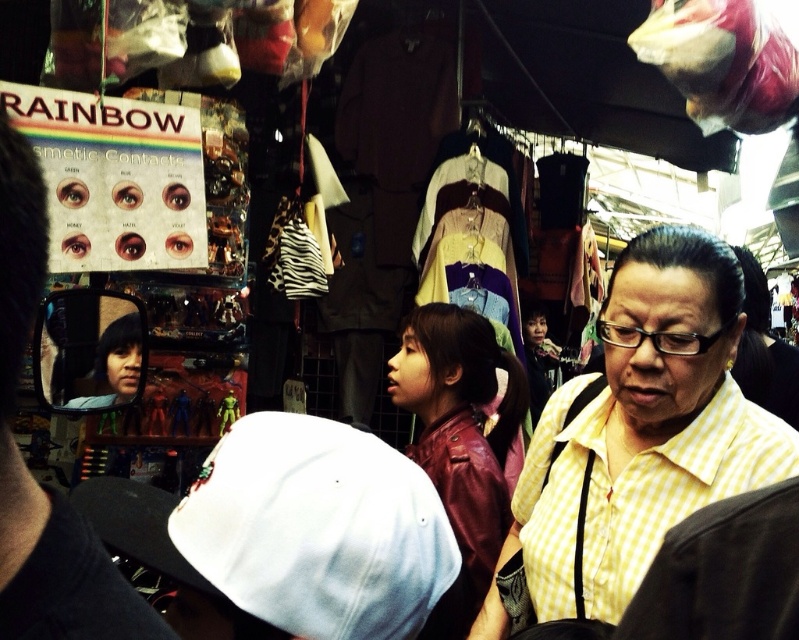
Question: Is yellow checkered shirt at center positioned behind leather jacket at center?

Choices:
 (A) no
 (B) yes

Answer: (B)

Question: Which object is positioned closest to the yellow checkered shirt at center?

Choices:
 (A) matte black cap at lower left
 (B) leather jacket at center

Answer: (B)

Question: Is yellow checkered shirt at center positioned behind matte black cap at lower left?

Choices:
 (A) no
 (B) yes

Answer: (B)

Question: Which object is farther from the camera taking this photo?

Choices:
 (A) matte black cap at lower left
 (B) leather jacket at center

Answer: (B)

Question: Is matte black cap at lower left thinner than leather jacket at center?

Choices:
 (A) yes
 (B) no

Answer: (A)

Question: Which is nearer to the leather jacket at center?

Choices:
 (A) matte black cap at lower left
 (B) yellow checkered shirt at center

Answer: (B)